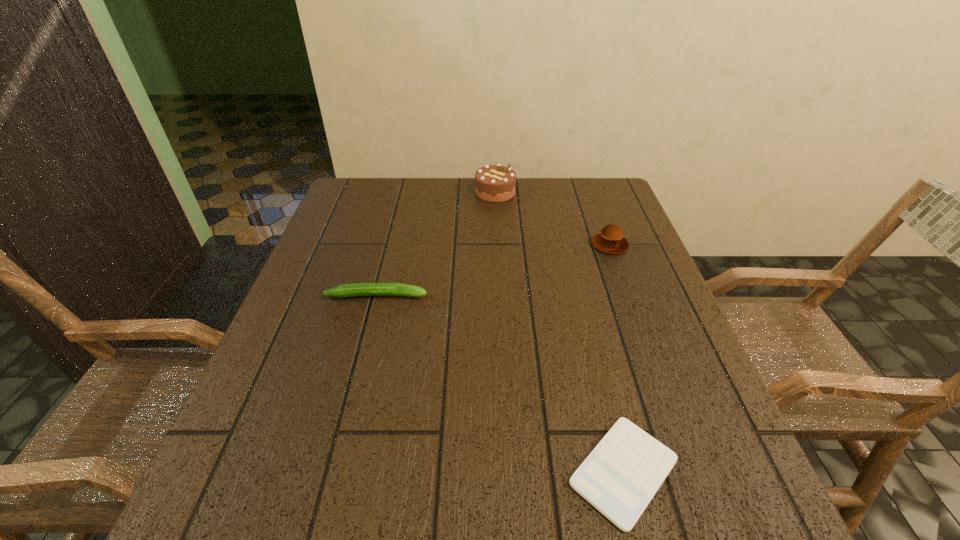
Find the location of a particular element. the farthest object is located at coordinates pyautogui.click(x=493, y=183).

The image size is (960, 540). Find the location of `chocolate cake`. chocolate cake is located at coordinates (493, 183).

At what (x,y) coordinates should I click in order to perform the action: click on muffin. Please return your answer as a coordinate pair (x, y). Looking at the image, I should click on (611, 240).

Find the location of a particular element. Image resolution: width=960 pixels, height=540 pixels. the second farthest object is located at coordinates (611, 240).

Locate an element on the screen. Image resolution: width=960 pixels, height=540 pixels. the second shortest object is located at coordinates (354, 289).

Identify the location of the third farthest object. (354, 289).

The image size is (960, 540). What are the coordinates of `the nearest object` in the screenshot? It's located at (621, 475).

This screenshot has width=960, height=540. I want to click on calculator, so click(x=621, y=475).

Locate an element on the screen. This screenshot has width=960, height=540. free space located on the right of the farthest object is located at coordinates (617, 192).

At what (x,y) coordinates should I click in order to perform the action: click on free space located 0.270m on the back of the second tallest object. Please return your answer as a coordinate pair (x, y). The image size is (960, 540). Looking at the image, I should click on (587, 183).